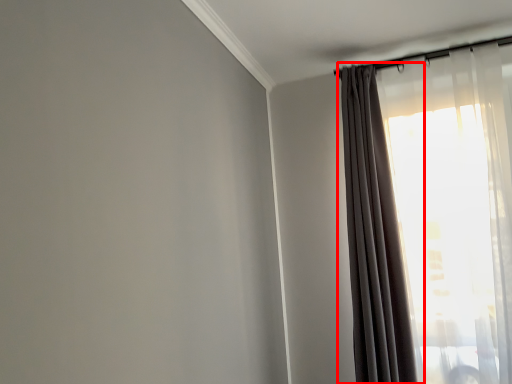
Question: From the image's perspective, where is curtain (annotated by the red box) located in relation to curtain in the image?

Choices:
 (A) below
 (B) above

Answer: (A)